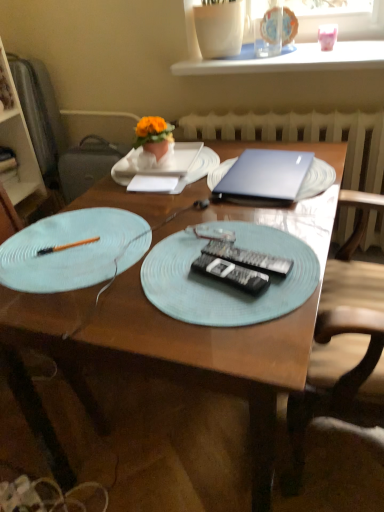
Find the location of `free location above light blue textured plate at left, placed as the second plate when sorted from front to back (from a real-world perspective)`. free location above light blue textured plate at left, placed as the second plate when sorted from front to back (from a real-world perspective) is located at coordinates tap(74, 241).